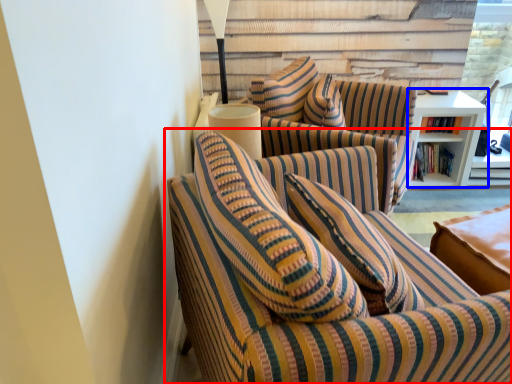
Question: Which object appears closest to the camera in this image, studio couch (highlighted by a red box) or table (highlighted by a blue box)?

Choices:
 (A) studio couch
 (B) table

Answer: (A)